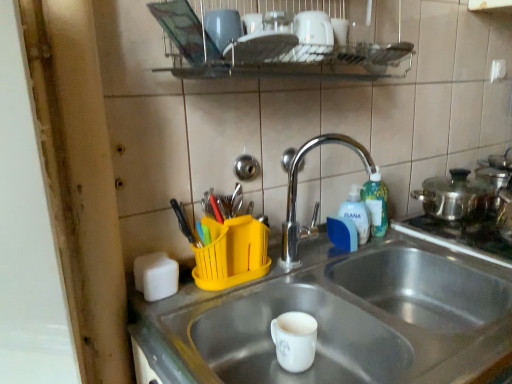
I want to click on vacant space to the right of blue plastic bottle at upper right, which appears as the 2th bottle when viewed from the right, so click(x=411, y=243).